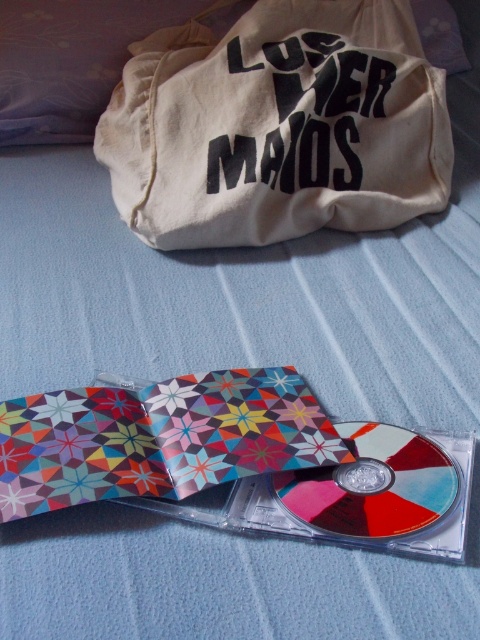
Question: Does beige canvas bag at upper center come behind multicolored glossy cd at center?

Choices:
 (A) yes
 (B) no

Answer: (A)

Question: Which is nearer to the multicolored glossy cd at center?

Choices:
 (A) beige canvas bag at upper center
 (B) multicolored paper cd case at center

Answer: (B)

Question: Which of these objects is positioned farthest from the multicolored paper cd case at center?

Choices:
 (A) beige canvas bag at upper center
 (B) multicolored glossy cd at center

Answer: (A)

Question: Which object appears closest to the camera in this image?

Choices:
 (A) beige canvas bag at upper center
 (B) multicolored glossy cd at center
 (C) multicolored paper cd case at center

Answer: (B)

Question: Is multicolored paper cd case at center below multicolored glossy cd at center?

Choices:
 (A) no
 (B) yes

Answer: (A)

Question: Does multicolored paper cd case at center have a smaller size compared to multicolored glossy cd at center?

Choices:
 (A) yes
 (B) no

Answer: (B)